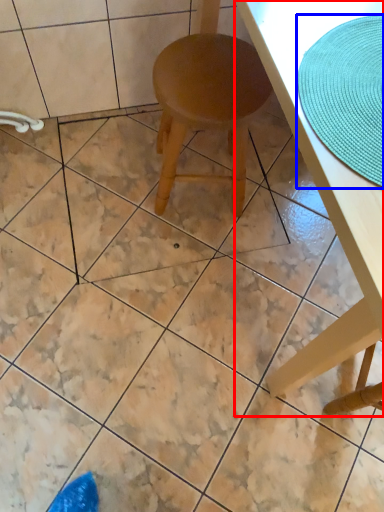
Question: Which of the following is the farthest to the observer, table (highlighted by a red box) or mat (highlighted by a blue box)?

Choices:
 (A) table
 (B) mat

Answer: (B)